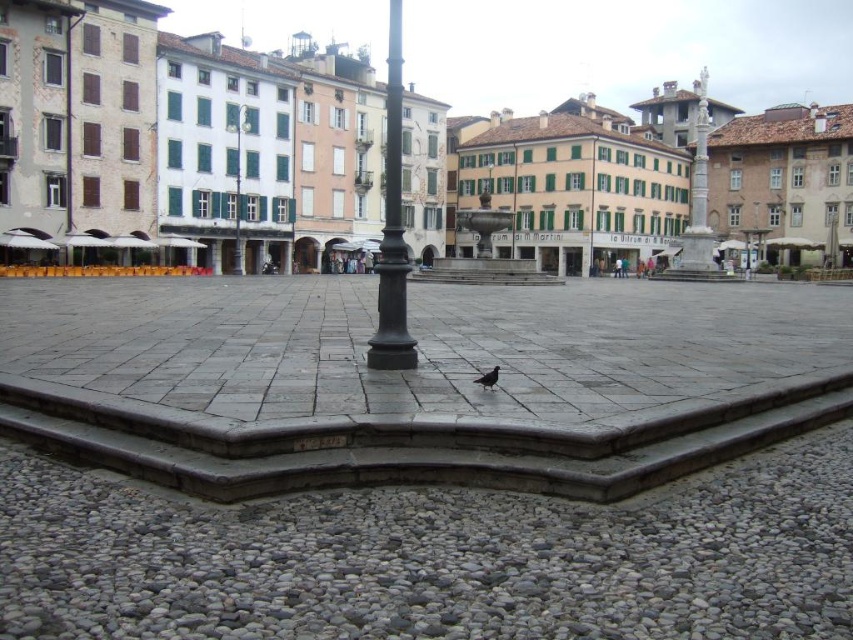
Question: Which object is positioned farthest from the brown matte bird at lower center?

Choices:
 (A) green glass lamp post at upper center
 (B) black metal pole at center
 (C) black metal pole at upper left

Answer: (A)

Question: Among these objects, which one is nearest to the camera?

Choices:
 (A) brown matte bird at lower center
 (B) black metal pole at center
 (C) black metal pole at upper left
 (D) green glass lamp post at upper center

Answer: (A)

Question: Can you confirm if green glass lamp post at upper center is wider than brown matte bird at lower center?

Choices:
 (A) yes
 (B) no

Answer: (A)

Question: Is black metal pole at upper left further to camera compared to brown matte bird at lower center?

Choices:
 (A) no
 (B) yes

Answer: (B)

Question: Can you confirm if black metal pole at center is positioned to the right of green glass lamp post at upper center?

Choices:
 (A) no
 (B) yes

Answer: (B)

Question: Which object is closer to the camera taking this photo?

Choices:
 (A) green glass lamp post at upper center
 (B) black metal pole at center
 (C) brown matte bird at lower center

Answer: (C)